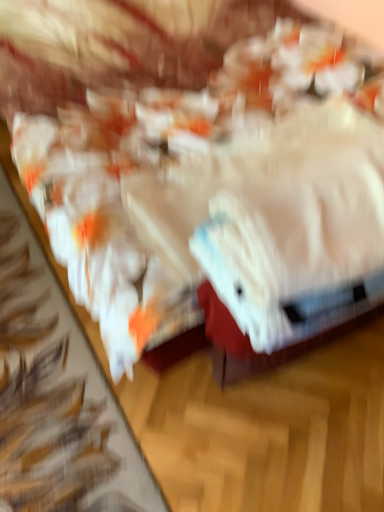
What is the approximate width of white glossy plastic bag at center?

The width of white glossy plastic bag at center is 7.57 feet.

At what (x,y) coordinates should I click in order to perform the action: click on white glossy plastic bag at center. Please return your answer as a coordinate pair (x, y). Looking at the image, I should click on (223, 191).

This screenshot has width=384, height=512. What do you see at coordinates (223, 191) in the screenshot?
I see `white glossy plastic bag at center` at bounding box center [223, 191].

Locate an element on the screen. Image resolution: width=384 pixels, height=512 pixels. white fluffy towel at center is located at coordinates (299, 226).

This screenshot has width=384, height=512. What do you see at coordinates (299, 226) in the screenshot? I see `white fluffy towel at center` at bounding box center [299, 226].

Locate an element on the screen. white glossy plastic bag at center is located at coordinates (223, 191).

Would you say white fluffy towel at center is to the left or to the right of white glossy plastic bag at center in the picture?

From the image, it's evident that white fluffy towel at center is to the right of white glossy plastic bag at center.

Which object is more forward, white fluffy towel at center or white glossy plastic bag at center?

white glossy plastic bag at center is closer to the camera.

Which is further, (x=319, y=163) or (x=62, y=243)?

The point (x=319, y=163) is farther.

From the picture: From the image's perspective, is white fluffy towel at center above or below white glossy plastic bag at center?

white fluffy towel at center is situated lower than white glossy plastic bag at center in the image.

From a real-world perspective, which object stands above the other?

white fluffy towel at center is physically above.

Does white fluffy towel at center have a greater width compared to white glossy plastic bag at center?

Incorrect, the width of white fluffy towel at center does not surpass that of white glossy plastic bag at center.

Considering the relative sizes of white fluffy towel at center and white glossy plastic bag at center in the image provided, is white fluffy towel at center shorter than white glossy plastic bag at center?

Correct, white fluffy towel at center is not as tall as white glossy plastic bag at center.

Considering the sizes of objects white fluffy towel at center and white glossy plastic bag at center in the image provided, who is bigger, white fluffy towel at center or white glossy plastic bag at center?

Bigger between the two is white glossy plastic bag at center.

Would you say white fluffy towel at center is outside white glossy plastic bag at center?

No.

Is white fluffy towel at center beside white glossy plastic bag at center?

There is a gap between white fluffy towel at center and white glossy plastic bag at center.

Is white fluffy towel at center looking in the opposite direction of white glossy plastic bag at center?

No, white fluffy towel at center's orientation is not away from white glossy plastic bag at center.

How many degrees apart are the facing directions of white fluffy towel at center and white glossy plastic bag at center?

6.29 degrees separate the facing orientations of white fluffy towel at center and white glossy plastic bag at center.

The height and width of the screenshot is (512, 384). In order to click on food on the left side of white fluffy towel at center in this screenshot , I will do `click(223, 191)`.

Is white glossy plastic bag at center to the left or to the right of white fluffy towel at center in the image?

white glossy plastic bag at center is to the left of white fluffy towel at center.

Does white glossy plastic bag at center lie behind white fluffy towel at center?

That is False.

Which is behind, point (312, 293) or point (354, 130)?

Point (354, 130)

From the image's perspective, between white glossy plastic bag at center and white fluffy towel at center, who is located below?

white fluffy towel at center, from the image's perspective.

From the picture: From a real-world perspective, which object stands above the other?

white fluffy towel at center, from a real-world perspective.

Is white glossy plastic bag at center wider or thinner than white fluffy towel at center?

white glossy plastic bag at center is wider than white fluffy towel at center.

Which of these two, white glossy plastic bag at center or white fluffy towel at center, stands taller?

white glossy plastic bag at center.

Considering the sizes of objects white glossy plastic bag at center and white fluffy towel at center in the image provided, who is smaller, white glossy plastic bag at center or white fluffy towel at center?

white fluffy towel at center.

Is white glossy plastic bag at center outside of white fluffy towel at center?

Absolutely, white glossy plastic bag at center is external to white fluffy towel at center.

Are white glossy plastic bag at center and white fluffy towel at center located far from each other?

Actually, white glossy plastic bag at center and white fluffy towel at center are a little close together.

Is white glossy plastic bag at center oriented away from white fluffy towel at center?

No, white fluffy towel at center is not at the back of white glossy plastic bag at center.

Measure the distance from white glossy plastic bag at center to white fluffy towel at center.

The distance of white glossy plastic bag at center from white fluffy towel at center is 16.76 inches.

In the image, there is a white fluffy towel at center. Where is `food below it (from a real-world perspective)`? The image size is (384, 512). food below it (from a real-world perspective) is located at coordinates (223, 191).

This screenshot has height=512, width=384. Find the location of `food lying in front of the white fluffy towel at center`. food lying in front of the white fluffy towel at center is located at coordinates (223, 191).

Find the location of a particular element. towel above the white glossy plastic bag at center (from a real-world perspective) is located at coordinates [x=299, y=226].